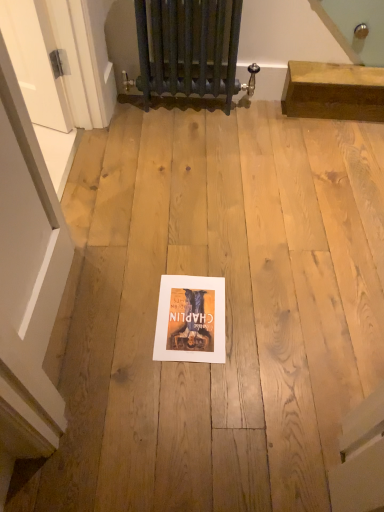
Where is `free space in front of matte paper postcard at center`? free space in front of matte paper postcard at center is located at coordinates (188, 385).